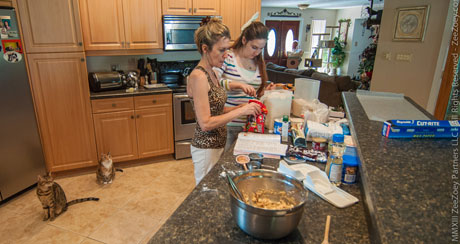
Image resolution: width=460 pixels, height=244 pixels. I want to click on stovetop, so click(177, 86).